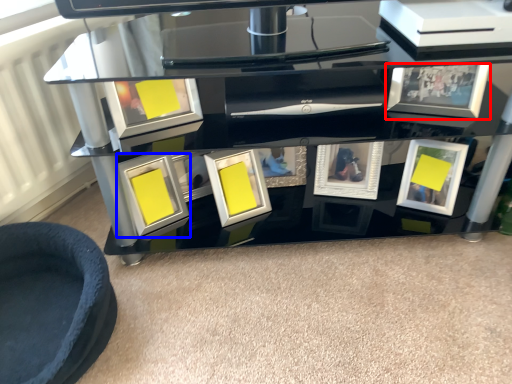
Question: Which object is closer to the camera taking this photo, picture frame (highlighted by a red box) or picture frame (highlighted by a blue box)?

Choices:
 (A) picture frame
 (B) picture frame

Answer: (A)